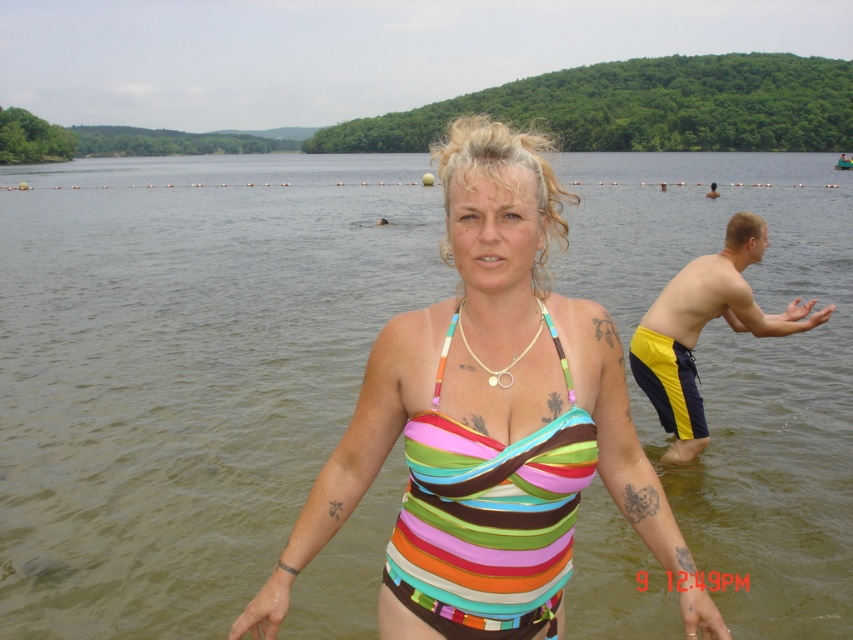
You are a photographer trying to capture the woman in the water. You need to ensure that both the multicolored striped swimsuit at center and the multicolored fabric bikini top at center are in focus. Given that your camera can only focus on objects within a 20 centimeter range, will both items be in focus?

The multicolored striped swimsuit at center is 23.78 centimeters from the multicolored fabric bikini top at center, which exceeds the camera focus range of 20 centimeters. Therefore, both items cannot be in focus simultaneously.

You are a photographer trying to capture the woman in the multicolored striped swimsuit at center. You want to focus on the exact point at coordinates point (x=485, y=420). Can you confirm if this point is located on her swimsuit?

Yes, the point (x=485, y=420) is on the multicolored striped swimsuit at center, so it is located on her swimsuit.

Based on the scene description, which object is positioned closer to the observer between the multicolored striped swimsuit at center and the multicolored fabric bikini top at center?

The multicolored striped swimsuit at center is closer to the observer because the multicolored fabric bikini top at center is positioned behind it.